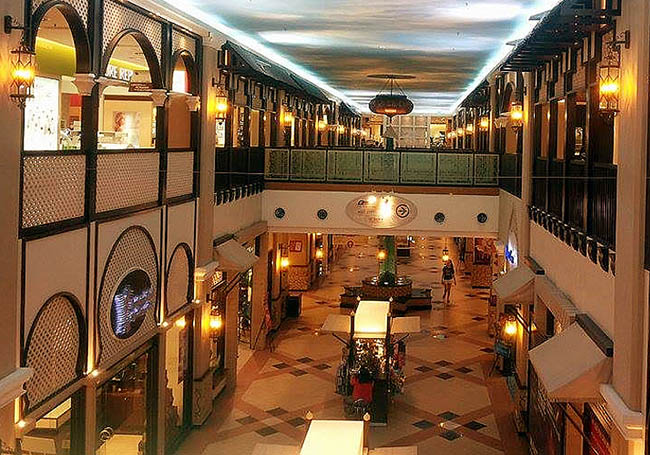
Find the location of `wall`. wall is located at coordinates (586, 237).